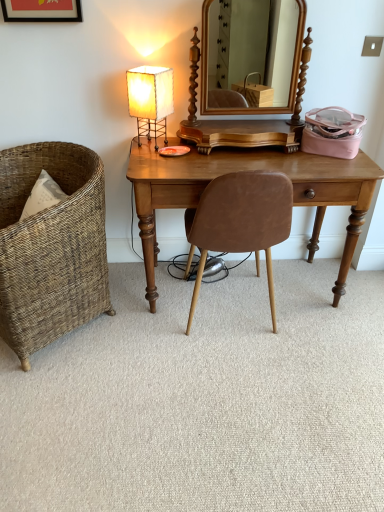
This screenshot has width=384, height=512. I want to click on blank space to the left of brown leather chair at center, placed as the second chair when sorted from left to right, so click(x=146, y=330).